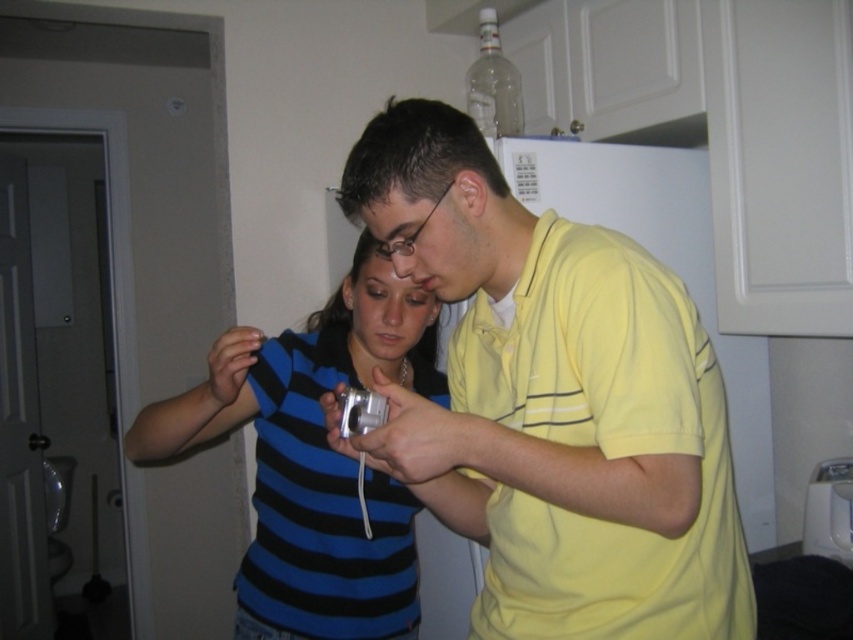
Question: Is yellow cotton shirt at center below silver metallic game controller at center?

Choices:
 (A) yes
 (B) no

Answer: (B)

Question: Which object appears closest to the camera in this image?

Choices:
 (A) yellow cotton shirt at center
 (B) silver metallic game controller at center

Answer: (A)

Question: Which point is closer to the camera?

Choices:
 (A) (300, 522)
 (B) (612, 484)

Answer: (B)

Question: Is blue striped shirt at center positioned in front of silver metallic game controller at center?

Choices:
 (A) yes
 (B) no

Answer: (B)

Question: Is yellow cotton shirt at center further to the viewer compared to silver metallic game controller at center?

Choices:
 (A) no
 (B) yes

Answer: (A)

Question: Which object is farther from the camera taking this photo?

Choices:
 (A) blue striped shirt at center
 (B) yellow cotton shirt at center

Answer: (A)